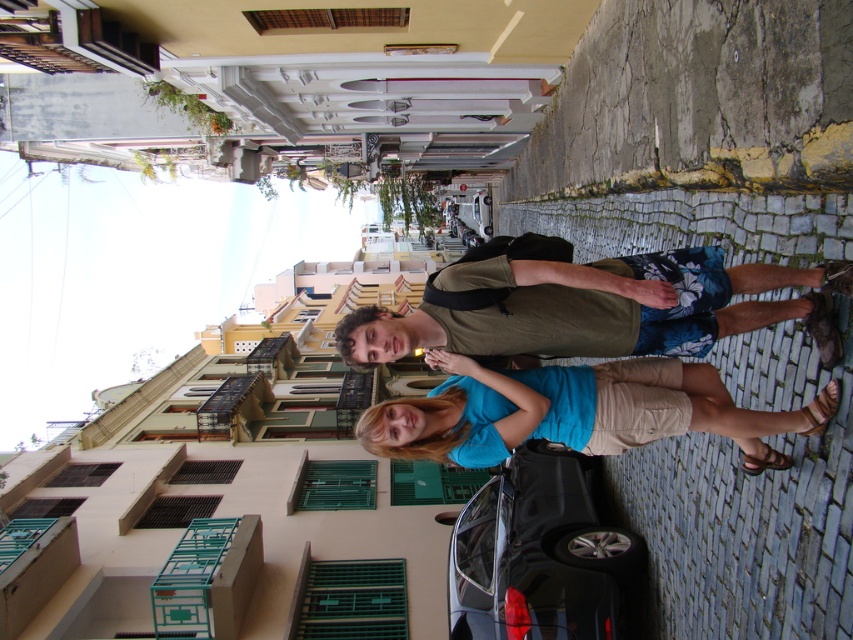
You are a photographer trying to capture a photo of both the green cotton shirt at center and the blue cotton shirt at center in the same frame. Since you want them to be clearly visible, you need to know their arrangement. Which shirt is located to the right of the other?

The green cotton shirt at center is positioned on the right side of blue cotton shirt at center, so the green cotton shirt at center is to the right of the blue cotton shirt at center.